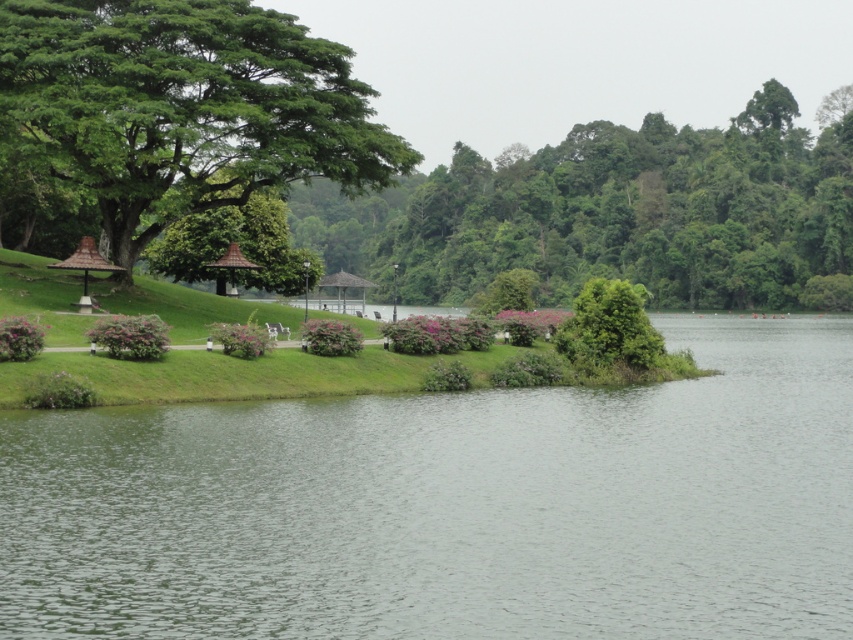
Question: Which point is farther to the camera?

Choices:
 (A) [x=361, y=280]
 (B) [x=300, y=564]

Answer: (A)

Question: Can you confirm if green leafy tree at upper left is positioned to the left of brown thatched roof gazebo at left?

Choices:
 (A) no
 (B) yes

Answer: (A)

Question: Which object is positioned closest to the brown thatched roof gazebo at center?

Choices:
 (A) clear water at center
 (B) green leafy tree at upper left

Answer: (B)

Question: Can you confirm if clear water at center is smaller than brown thatched roof gazebo at left?

Choices:
 (A) yes
 (B) no

Answer: (B)

Question: Based on their relative distances, which object is farther from the green leafy tree at upper left?

Choices:
 (A) clear water at center
 (B) brown thatched roof gazebo at left
 (C) brown thatched roof gazebo at center
 (D) wooden gazebo at center

Answer: (D)

Question: Where is brown thatched roof gazebo at center located in relation to wooden gazebo at center in the image?

Choices:
 (A) left
 (B) right

Answer: (B)